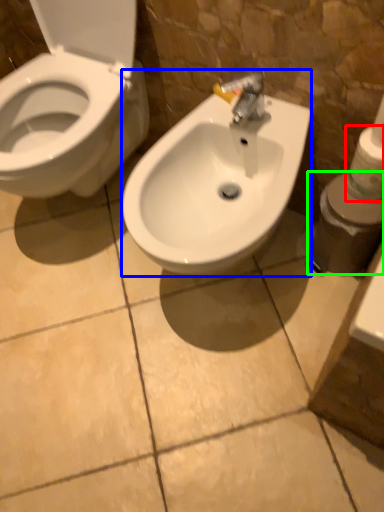
Question: Estimate the real-world distances between objects in this image. Which object is farther from toilet paper (highlighted by a red box), sink (highlighted by a blue box) or toiletries (highlighted by a green box)?

Choices:
 (A) sink
 (B) toiletries

Answer: (A)